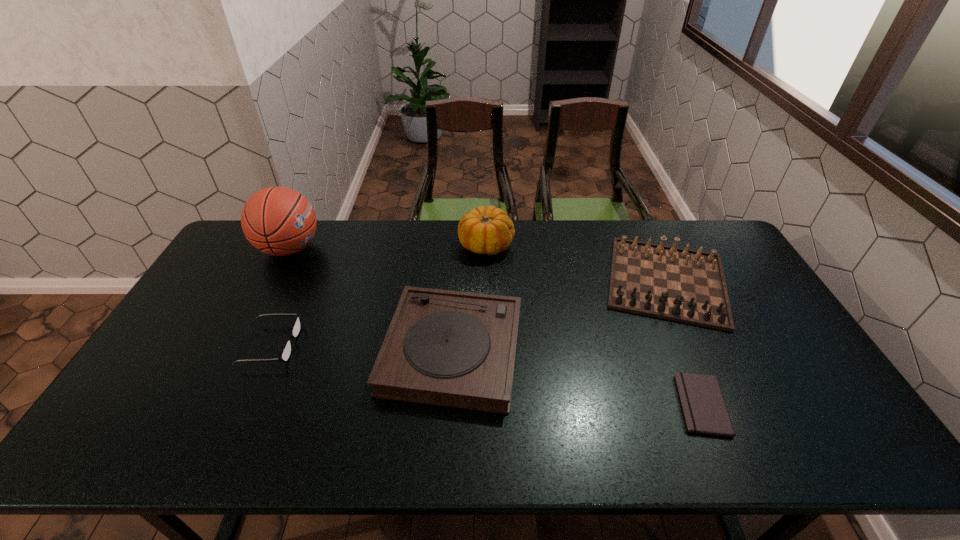
Where is `the second closest object to the chessboard`? the second closest object to the chessboard is located at coordinates (488, 230).

Find the location of a particular element. object that is the fifth closest to the phonograph record is located at coordinates (703, 406).

Where is `free space that satisfies the following two spatial constraints: 1. on the logo side of the tallest object; 2. on the left side of the checkbook`? Image resolution: width=960 pixels, height=540 pixels. free space that satisfies the following two spatial constraints: 1. on the logo side of the tallest object; 2. on the left side of the checkbook is located at coordinates (209, 405).

Find the location of a particular element. The height and width of the screenshot is (540, 960). vacant space that satisfies the following two spatial constraints: 1. on the logo side of the tallest object; 2. on the back side of the phonograph record is located at coordinates (237, 350).

The image size is (960, 540). What are the coordinates of `blank space that satisfies the following two spatial constraints: 1. on the logo side of the basketball; 2. on the left side of the shortest object` in the screenshot? It's located at (209, 405).